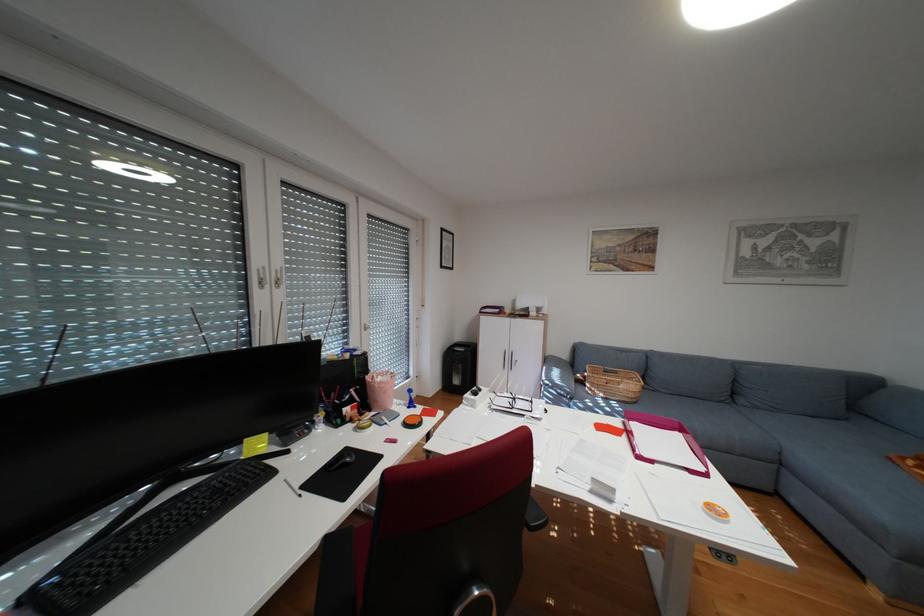
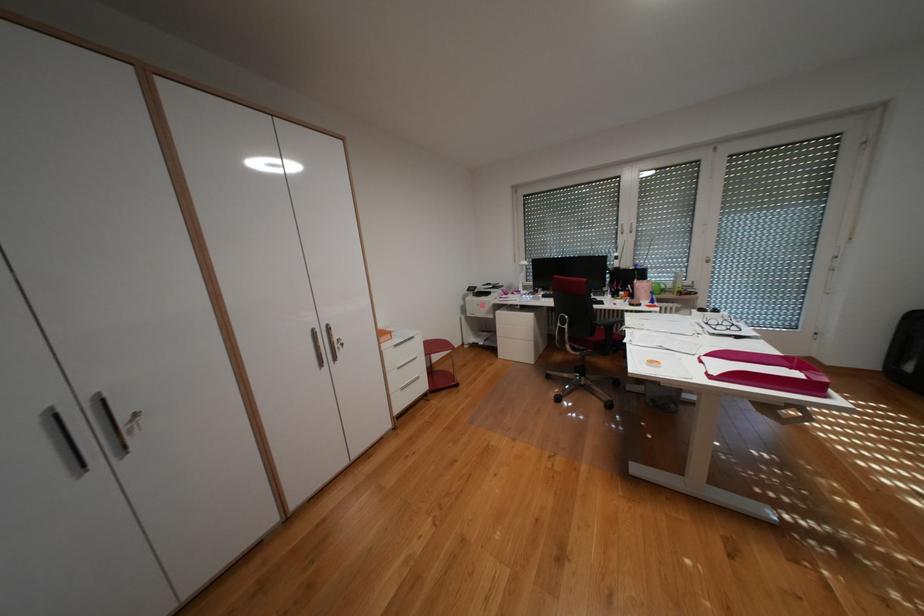
Where in the second image is the point corresponding to pixel 719 475 from the first image?

(723, 377)